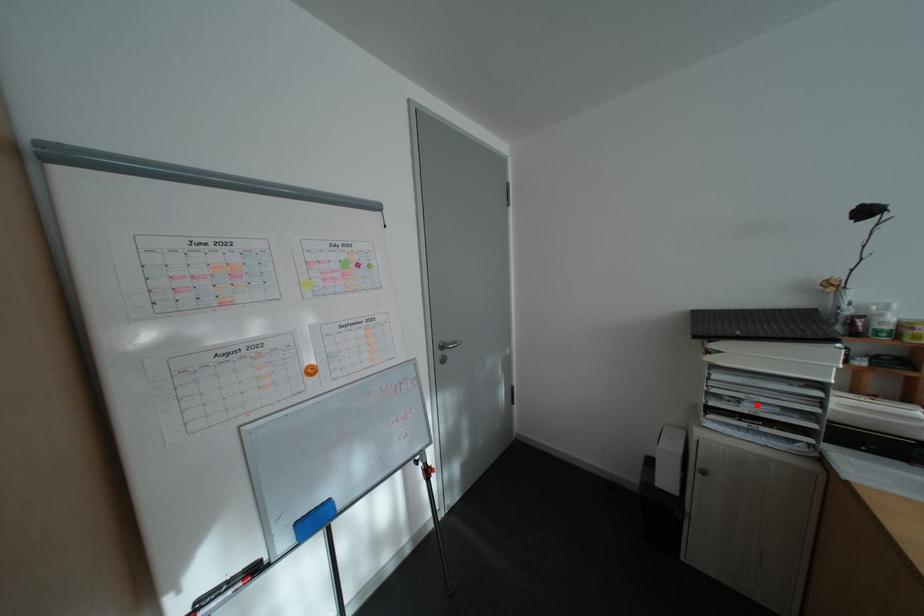
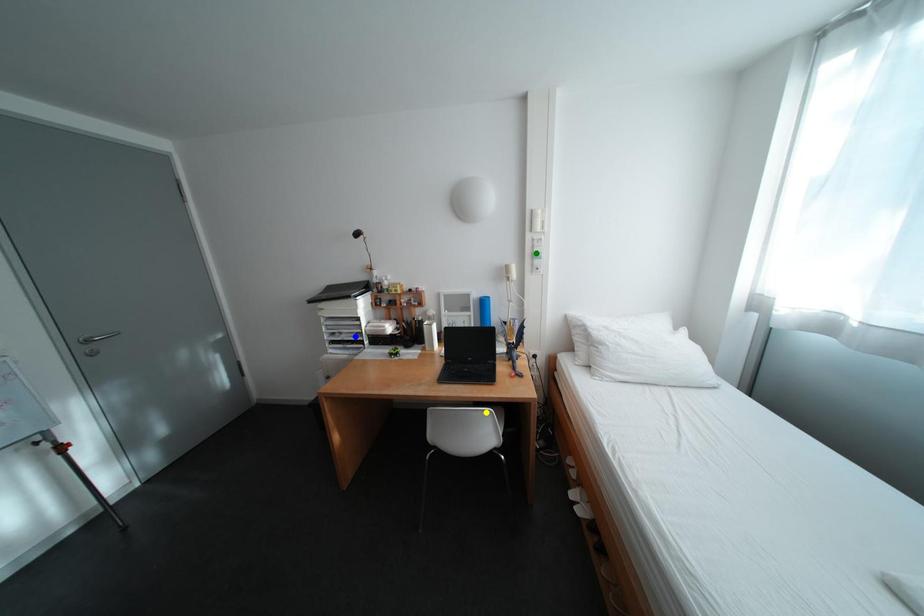
Question: I am providing you with two images of the same scene from different viewpoints. A red point is marked on the first image. You are given multiple points on the second image. Which spot in image 2 lines up with the point in image 1?

Choices:
 (A) yellow point
 (B) blue point
 (C) green point

Answer: (B)